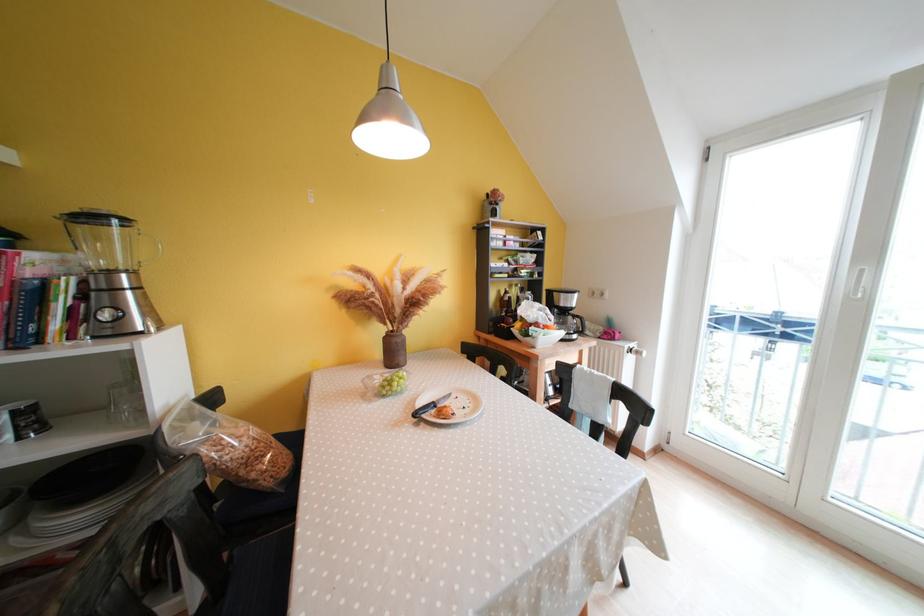
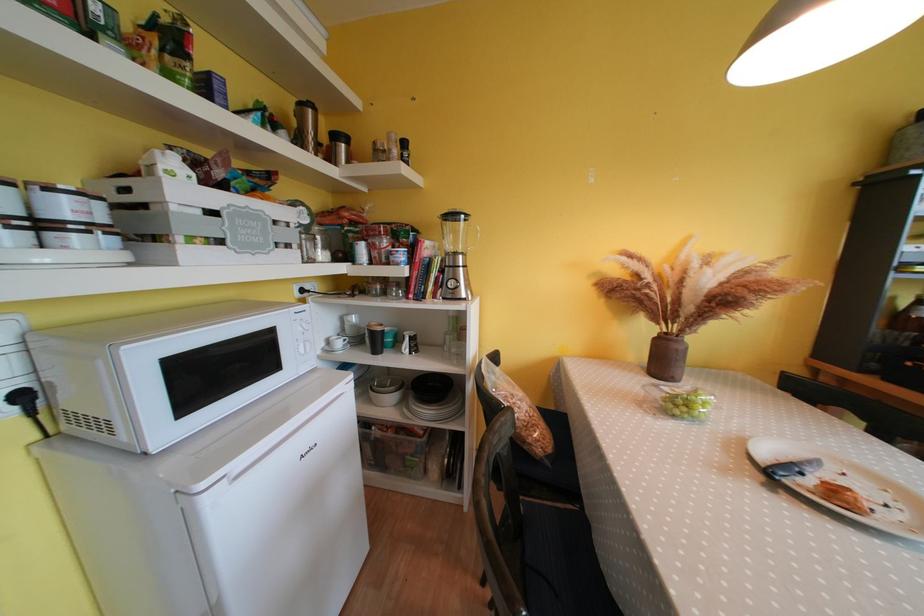
Find the pixel in the second image that matches (x=405, y=344) in the first image.

(687, 351)